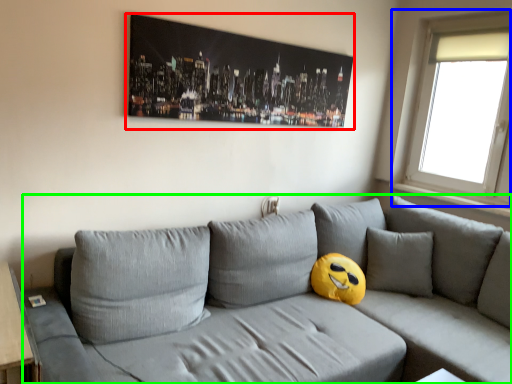
Question: Which object is positioned farthest from picture frame (highlighted by a red box)? Select from window (highlighted by a blue box) and studio couch (highlighted by a green box).

Choices:
 (A) window
 (B) studio couch

Answer: (A)